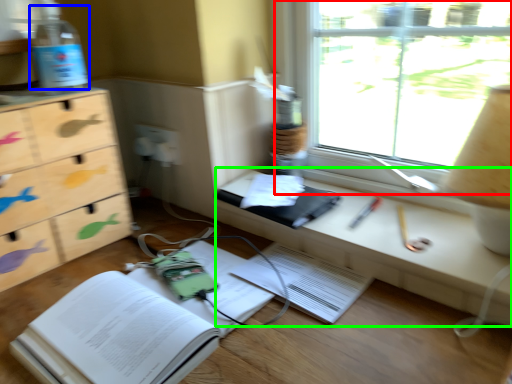
Question: Estimate the real-world distances between objects in this image. Which object is closer to window (highlighted by a red box), bottle (highlighted by a blue box) or computer desk (highlighted by a green box)?

Choices:
 (A) bottle
 (B) computer desk

Answer: (B)